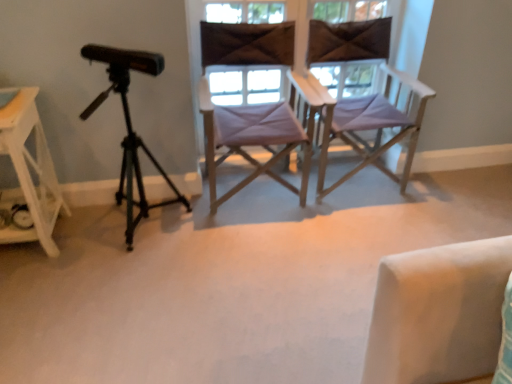
Find the location of a particular element. The height and width of the screenshot is (384, 512). vacant area that is situated to the right of black matte tripod at left is located at coordinates (221, 244).